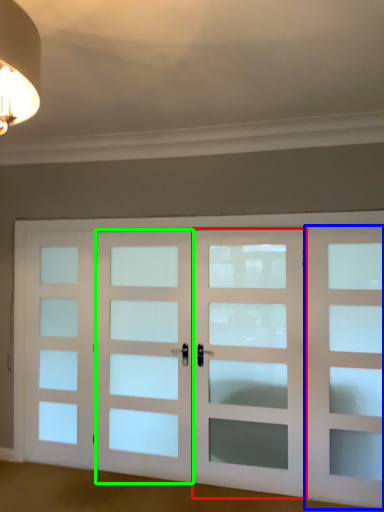
Question: Considering the real-world distances, which object is closest to screen door (highlighted by a red box)? screen door (highlighted by a blue box) or screen door (highlighted by a green box).

Choices:
 (A) screen door
 (B) screen door

Answer: (A)